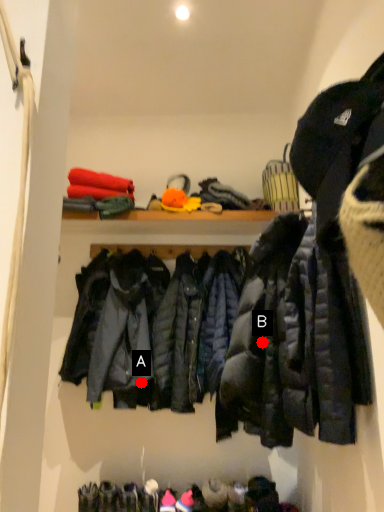
Question: Two points are circled on the image, labeled by A and B beside each circle. Which point is further to the camera?

Choices:
 (A) A is further
 (B) B is further

Answer: (A)